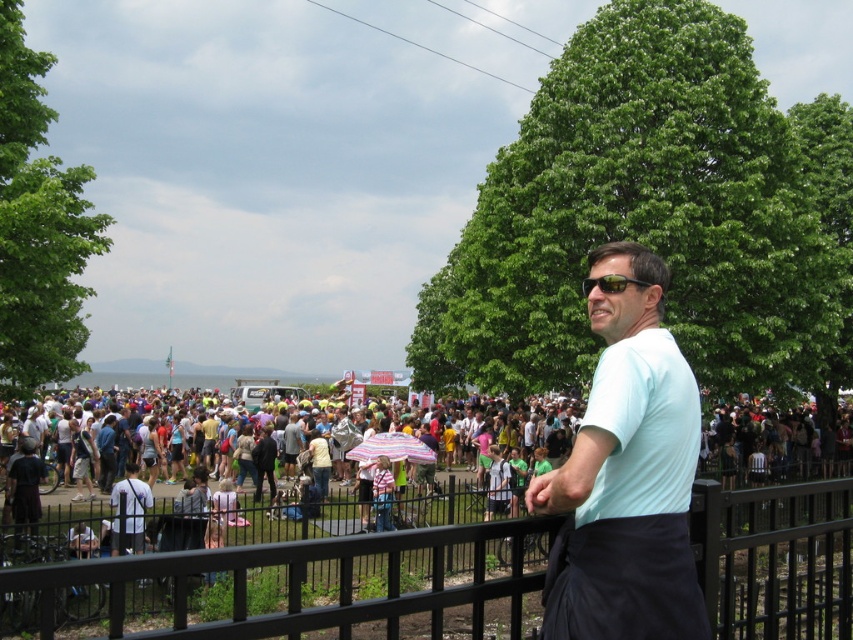
Question: Where is white fabric shirt at lower left located in relation to striped fabric umbrella at center in the image?

Choices:
 (A) left
 (B) right

Answer: (A)

Question: Which point is closer to the camera?

Choices:
 (A) light blue cotton polo shirt at center-right
 (B) black reflective sunglasses at center
 (C) white fabric shirt at lower left

Answer: (A)

Question: Can you confirm if striped fabric umbrella at center is positioned to the right of black reflective sunglasses at center?

Choices:
 (A) yes
 (B) no

Answer: (B)

Question: Which object appears closest to the camera in this image?

Choices:
 (A) light blue shirt at center
 (B) light blue cotton polo shirt at center-right

Answer: (A)

Question: Is light blue shirt at center bigger than striped fabric umbrella at center?

Choices:
 (A) no
 (B) yes

Answer: (A)

Question: Which of the following is the closest to the observer?

Choices:
 (A) light blue shirt at center
 (B) light blue cotton polo shirt at center-right

Answer: (A)